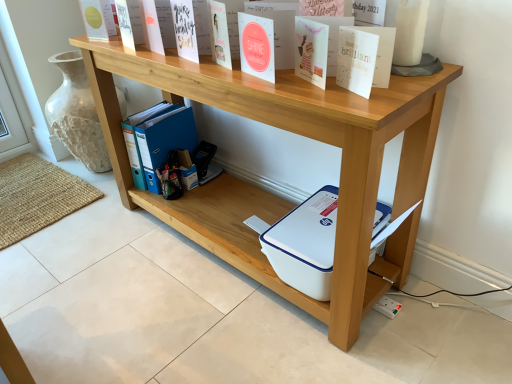
I want to click on free space in front of natural wood shelf at upper center, which appears as the 1th shelf when viewed from the top, so click(236, 335).